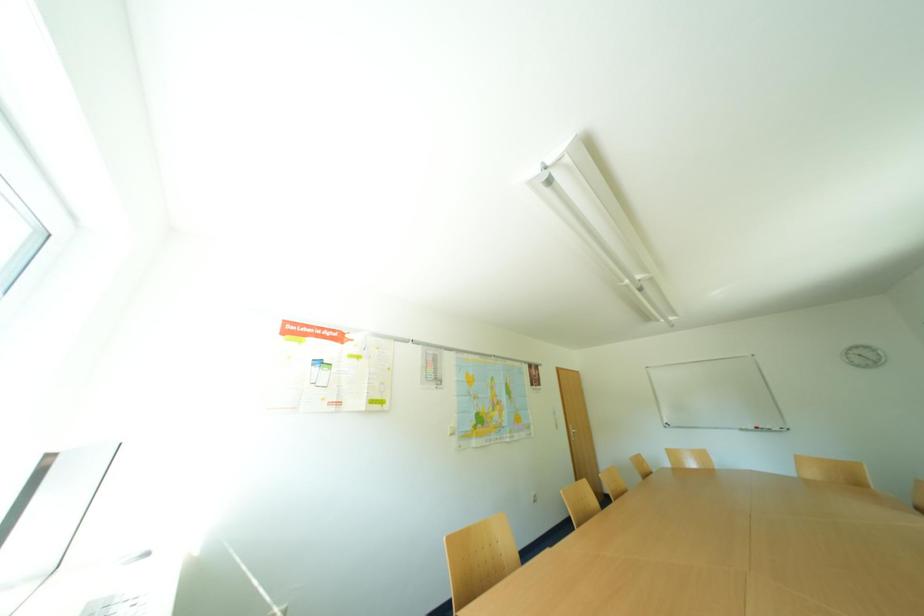
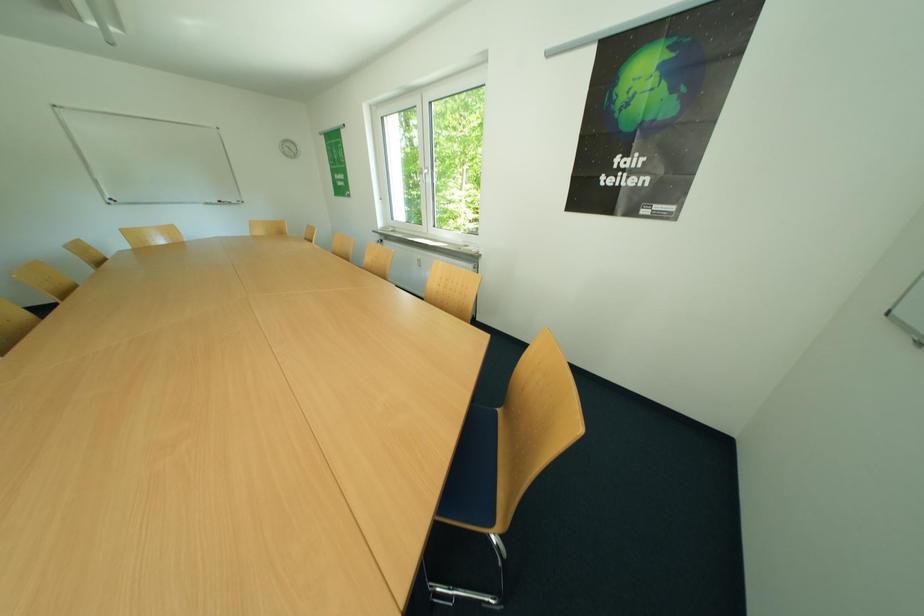
First-person continuous shooting, in which direction is the camera rotating?

The rotation direction of the camera is right-down.